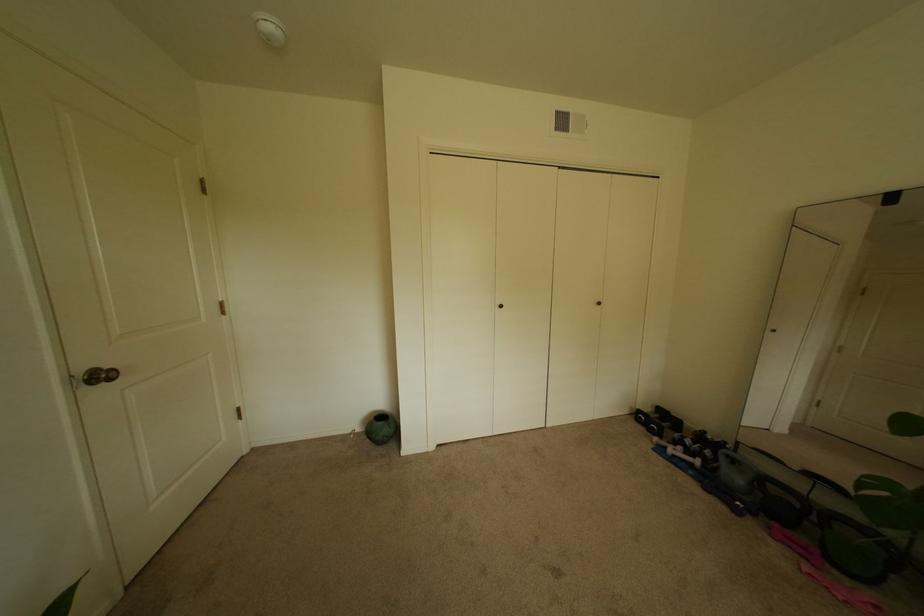
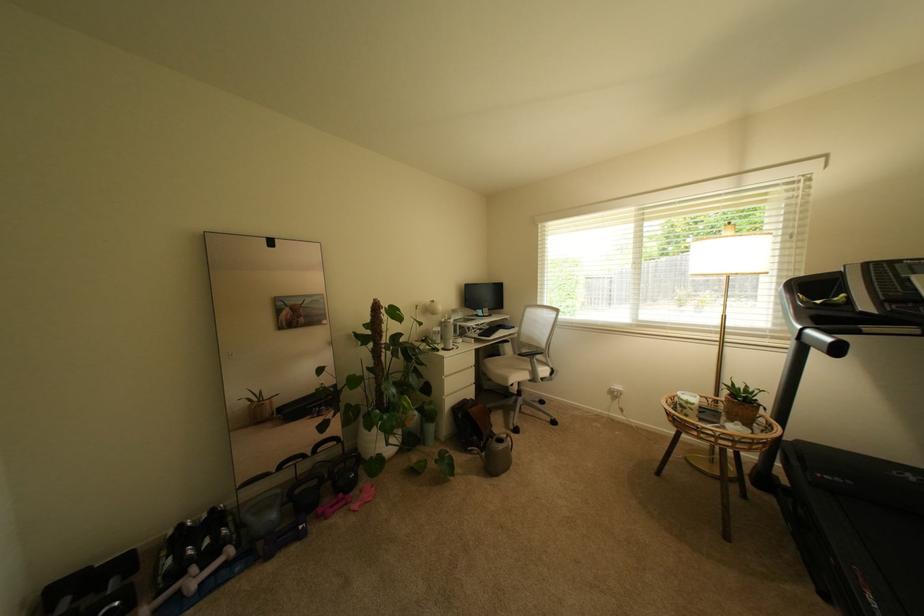
Locate, in the second image, the point that corresponds to [796,539] in the first image.

(339, 508)